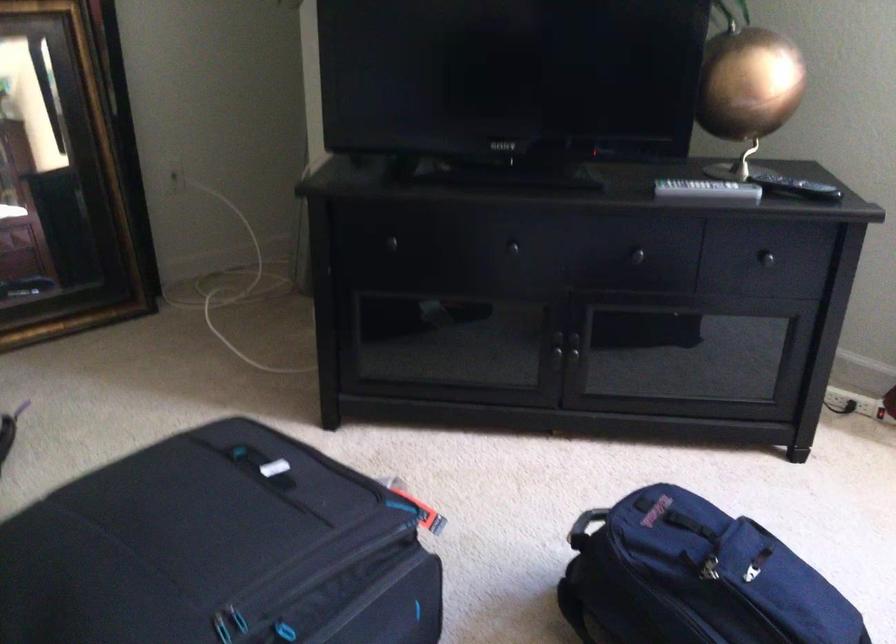
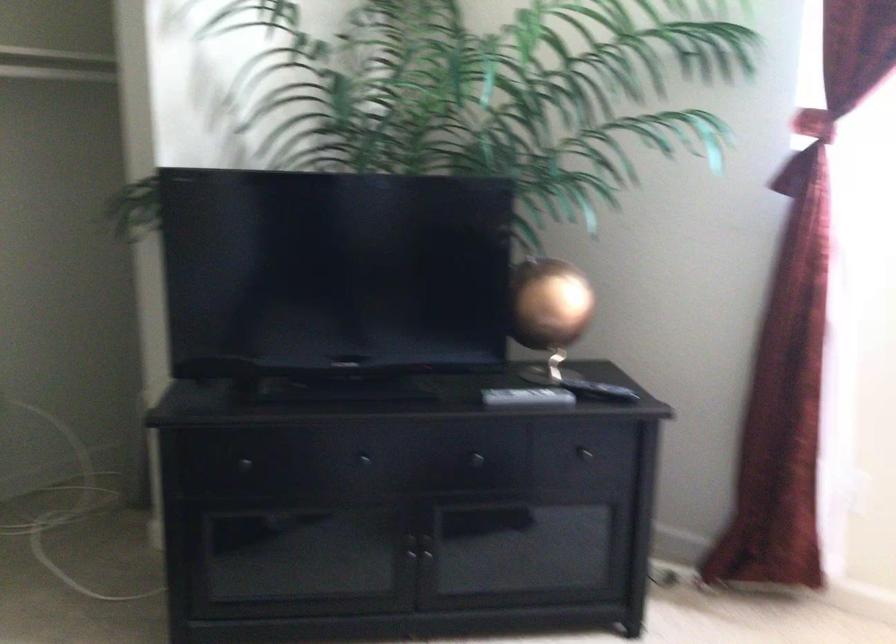
Locate, in the second image, the point that corresponds to [582,352] in the first image.

(434, 550)